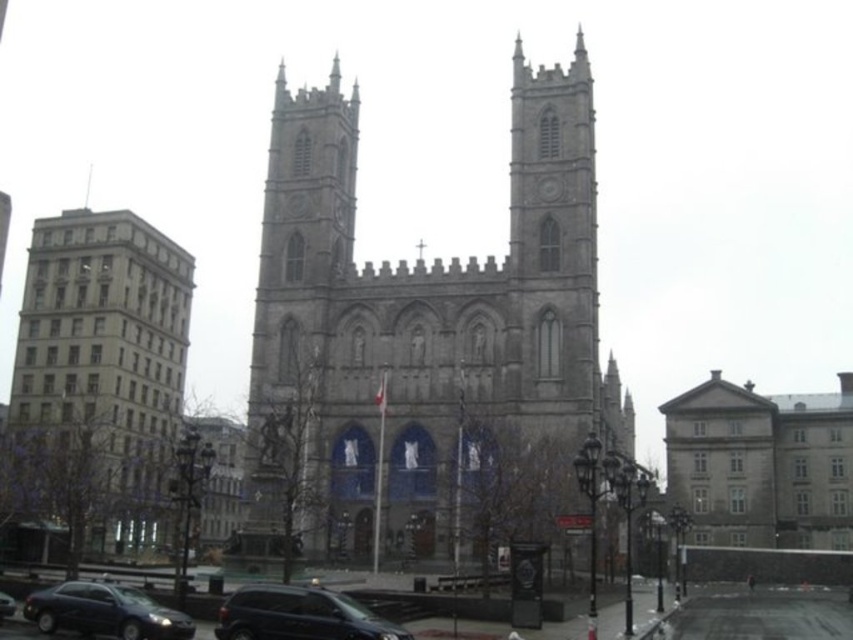
You are standing at the point marked as point (761, 465) in the image. What structure are you facing?

The point (761, 465) corresponds to the gray stone church at right, so you are facing the gray stone church at right.

You are a photographer standing at the lower left corner of the image. You want to take a picture of the gray stone church at center without the matte black sedan at lower left appearing in the frame. Is the sedan positioned in a way that it might block your view of the church?

Result: The gray stone church at center is located above the matte black sedan at lower left, so the sedan is positioned lower down. Since you are standing at the lower left corner, the sedan might block your view of the church unless you move to a higher angle or position to look over the sedan.